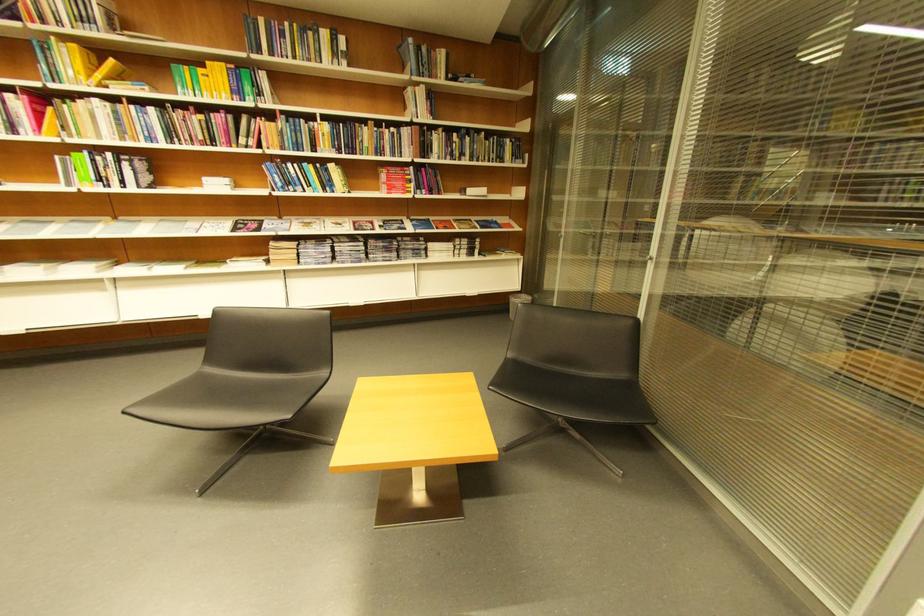
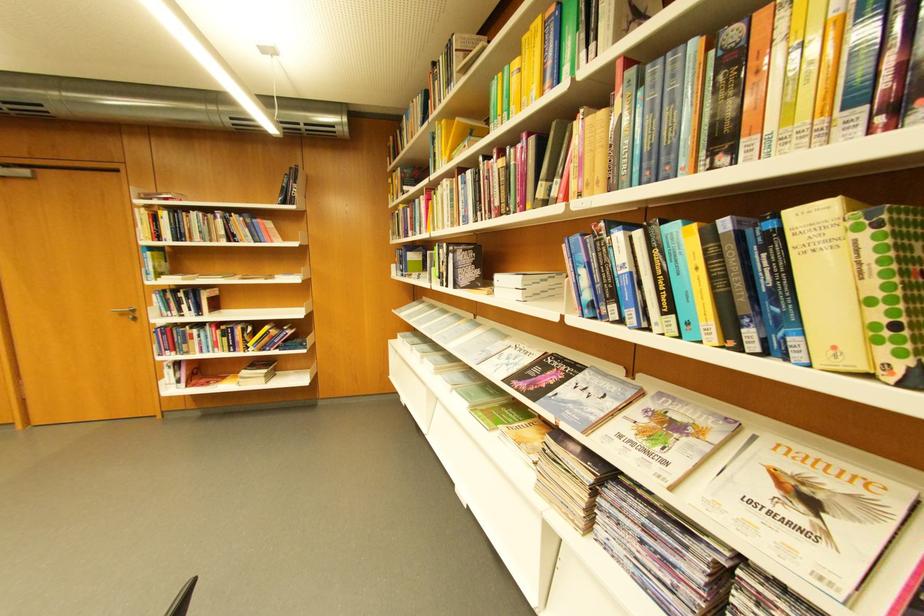
Locate, in the second image, the point that corresponds to the point at 338,167 in the first image.

(796, 214)